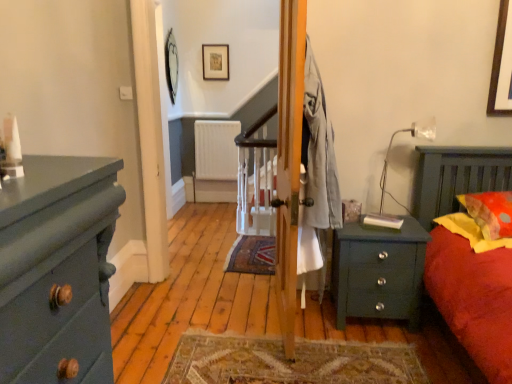
Question: Could you tell me if wooden picture frame at upper center, placed as the second picture frame when sorted from left to right, is turned towards yellow fabric pillow at right, which is counted as the second pillow, starting from the top?

Choices:
 (A) no
 (B) yes

Answer: (A)

Question: Is wooden picture frame at upper center, placed as the second picture frame when sorted from left to right, smaller than yellow fabric pillow at right, which appears as the 1th pillow when ordered from the bottom?

Choices:
 (A) no
 (B) yes

Answer: (B)

Question: From the image's perspective, is wooden picture frame at upper center, positioned as the 1th picture frame in right-to-left order, on yellow fabric pillow at right, which is counted as the second pillow, starting from the top?

Choices:
 (A) yes
 (B) no

Answer: (A)

Question: Does wooden picture frame at upper center, placed as the second picture frame when sorted from left to right, have a larger size compared to yellow fabric pillow at right, which is counted as the second pillow, starting from the top?

Choices:
 (A) no
 (B) yes

Answer: (A)

Question: Is wooden picture frame at upper center, placed as the second picture frame when sorted from left to right, further to the viewer compared to yellow fabric pillow at right, which appears as the 1th pillow when ordered from the bottom?

Choices:
 (A) no
 (B) yes

Answer: (B)

Question: Relative to wooden picture frame at upper center, placed as the second picture frame when sorted from left to right, is matte dark green dresser at left in front or behind?

Choices:
 (A) behind
 (B) front

Answer: (B)

Question: Based on their positions, is matte dark green dresser at left located to the left or right of wooden picture frame at upper center, placed as the second picture frame when sorted from left to right?

Choices:
 (A) right
 (B) left

Answer: (B)

Question: Is matte dark green dresser at left situated inside wooden picture frame at upper center, placed as the second picture frame when sorted from left to right, or outside?

Choices:
 (A) inside
 (B) outside

Answer: (B)

Question: Based on their sizes in the image, would you say matte dark green dresser at left is bigger or smaller than wooden picture frame at upper center, placed as the second picture frame when sorted from left to right?

Choices:
 (A) small
 (B) big

Answer: (B)

Question: From the image's perspective, is matte dark green dresser at left positioned above or below yellow fabric pillow at right, which appears as the 1th pillow when ordered from the bottom?

Choices:
 (A) below
 (B) above

Answer: (A)

Question: In terms of height, does matte dark green dresser at left look taller or shorter compared to yellow fabric pillow at right, which appears as the 1th pillow when ordered from the bottom?

Choices:
 (A) tall
 (B) short

Answer: (A)

Question: Is matte dark green dresser at left spatially inside yellow fabric pillow at right, which is counted as the second pillow, starting from the top, or outside of it?

Choices:
 (A) inside
 (B) outside

Answer: (B)

Question: In terms of size, does matte dark green dresser at left appear bigger or smaller than yellow fabric pillow at right, which appears as the 1th pillow when ordered from the bottom?

Choices:
 (A) big
 (B) small

Answer: (A)

Question: From a real-world perspective, relative to white matte radiator at center, is matte dark green dresser at left vertically above or below?

Choices:
 (A) below
 (B) above

Answer: (B)

Question: Is matte dark green dresser at left situated inside white matte radiator at center or outside?

Choices:
 (A) outside
 (B) inside

Answer: (A)